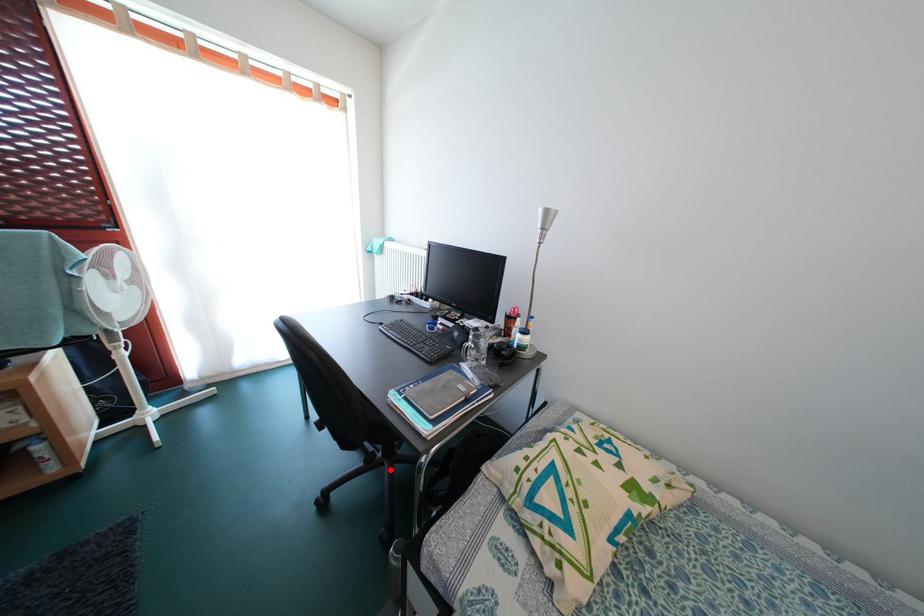
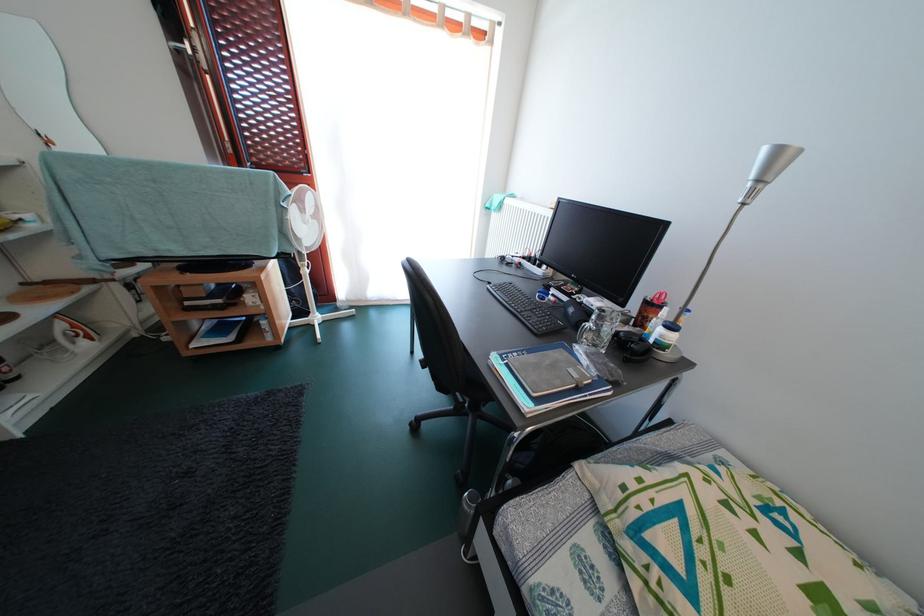
Question: I am providing you with two images of the same scene from different viewpoints. In image1, a red point is highlighted. Considering the same 3D point in image2, which of the following is correct?

Choices:
 (A) It is closer
 (B) It is farther

Answer: (A)